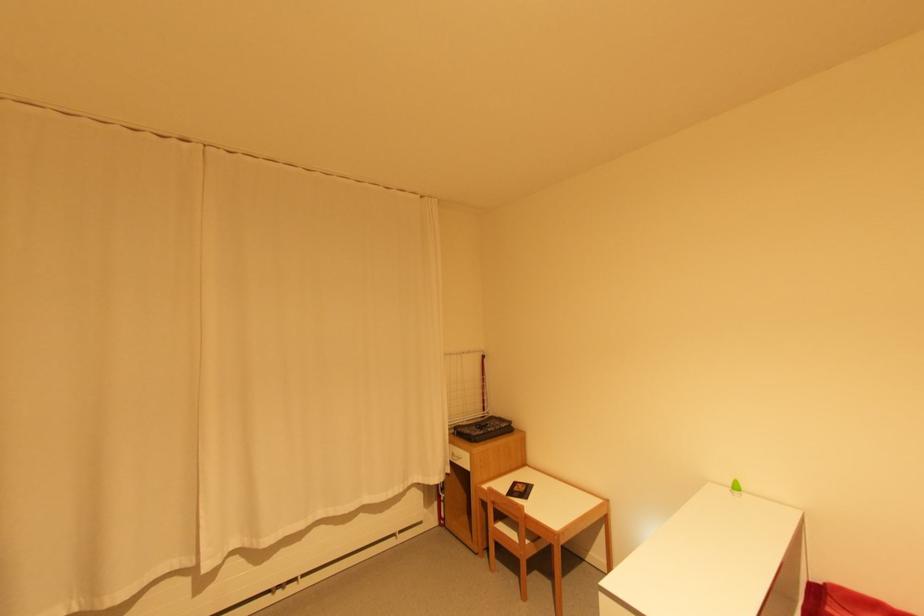
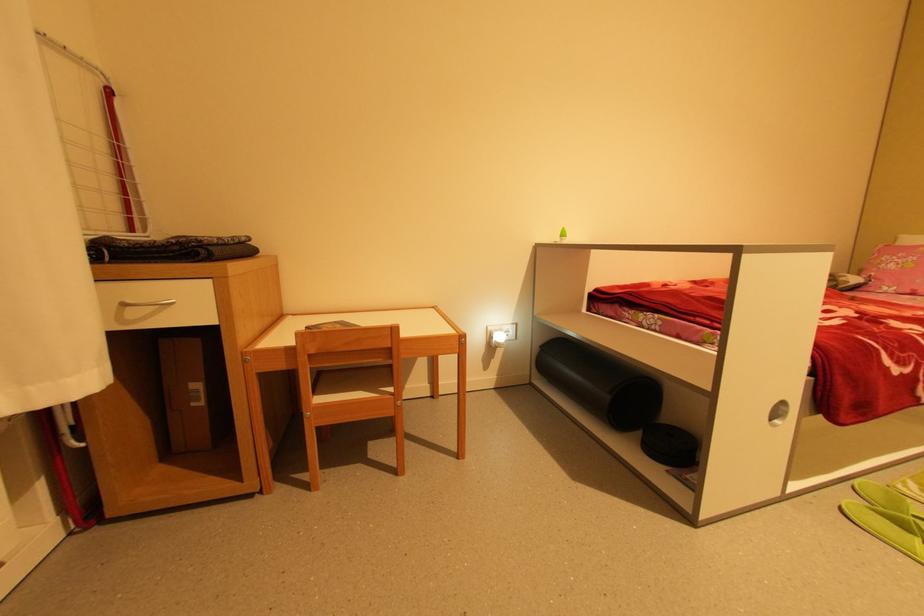
In the second image, find the point that corresponds to (458,453) in the first image.

(134, 302)